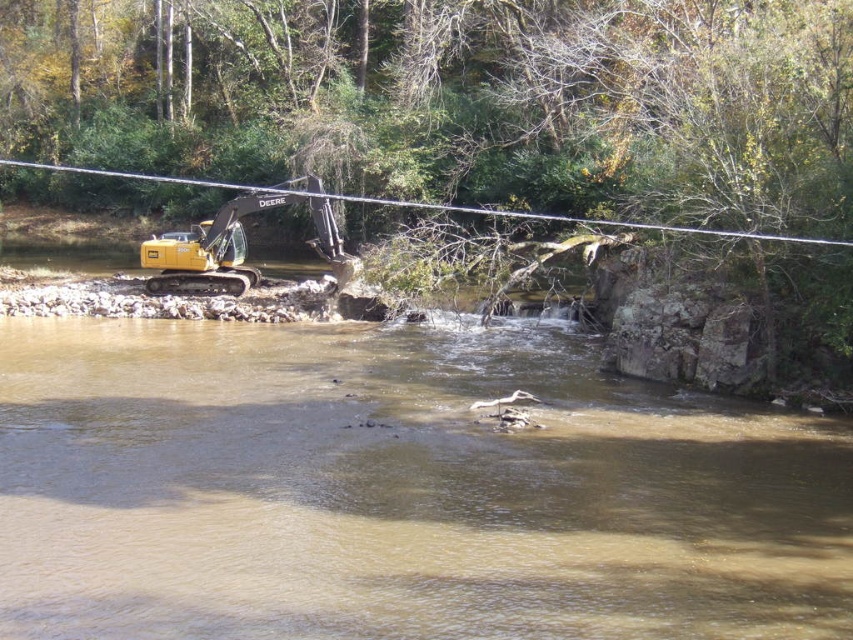
Question: Observing the image, what is the correct spatial positioning of yellow metallic excavator at upper left in reference to smooth wire at upper center?

Choices:
 (A) right
 (B) left

Answer: (B)

Question: Which point is closer to the camera taking this photo?

Choices:
 (A) (109, 172)
 (B) (235, 291)
 (C) (309, 516)

Answer: (C)

Question: Is brown sedimentary water at left smaller than smooth wire at upper center?

Choices:
 (A) yes
 (B) no

Answer: (A)

Question: Which object is farther from the camera taking this photo?

Choices:
 (A) brown sedimentary water at left
 (B) yellow metallic excavator at upper left
 (C) smooth wire at upper center

Answer: (B)

Question: Among these objects, which one is nearest to the camera?

Choices:
 (A) smooth wire at upper center
 (B) yellow metallic excavator at upper left

Answer: (A)

Question: Can you confirm if brown sedimentary water at left is positioned above smooth wire at upper center?

Choices:
 (A) yes
 (B) no

Answer: (B)